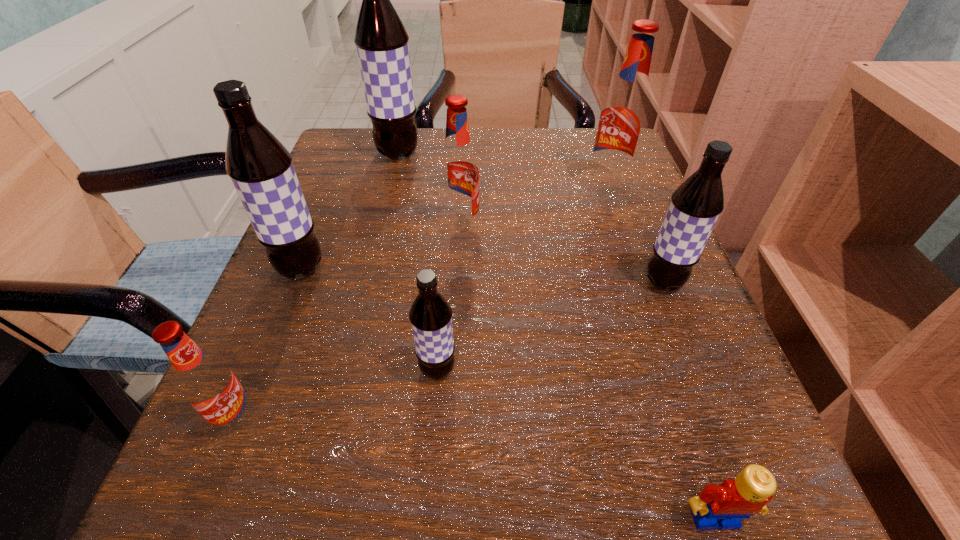
Locate an element on the screen. the nearest brown root beer is located at coordinates (430, 315).

The image size is (960, 540). Find the location of `the second brown root beer from right to left`. the second brown root beer from right to left is located at coordinates (430, 315).

Identify the location of red Lego. The height and width of the screenshot is (540, 960). (724, 506).

Where is `Lego`? The image size is (960, 540). Lego is located at coordinates (724, 506).

This screenshot has height=540, width=960. In order to click on vacant area situated on the right of the farthest root beer in this screenshot , I will do point(493,154).

Image resolution: width=960 pixels, height=540 pixels. What are the coordinates of `vacant area situated on the left of the farthest red root beer` in the screenshot? It's located at (562, 186).

Where is `vacant space located 0.340m on the front of the third smallest brown root beer`? vacant space located 0.340m on the front of the third smallest brown root beer is located at coordinates (198, 528).

Identify the location of vacant space situated on the right of the fifth nearest root beer. (586, 228).

You are a GUI agent. You are given a task and a screenshot of the screen. Output one action in this format:
    pyautogui.click(x=<x>, y=<y>)
    Task: Click on the vacant region located 0.210m on the left of the rightmost brown root beer
    This screenshot has width=960, height=540.
    Given the screenshot: What is the action you would take?
    pyautogui.click(x=510, y=282)

Identify the location of blank space located 0.120m on the back of the nearest root beer. This screenshot has width=960, height=540. (276, 326).